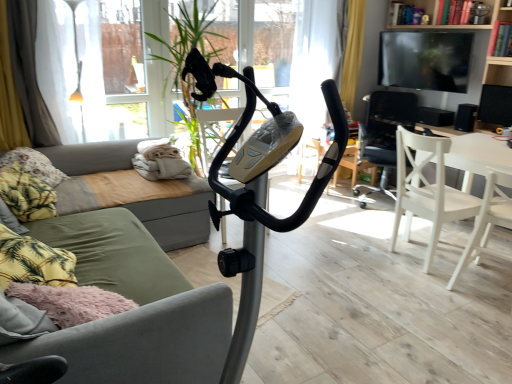
Question: Is white wood chair at center right, which is the first chair in back-to-front order, in front of or behind green fabric couch at center in the image?

Choices:
 (A) behind
 (B) front

Answer: (A)

Question: From a real-world perspective, is white wood chair at center right, which is the first chair in back-to-front order, positioned above or below green fabric couch at center?

Choices:
 (A) above
 (B) below

Answer: (A)

Question: Based on their relative distances, which object is nearer to the white wood chair at lower right, positioned as the 2th chair in back-to-front order?

Choices:
 (A) wooden bookshelf at upper right
 (B) fluffy fabric pillow at left, placed as the second pillow when sorted from back to front
 (C) black glossy tv at upper right
 (D) black matte speaker at center, which is the 1th speaker in back-to-front order
 (E) green fabric couch at center

Answer: (D)

Question: Which of these objects is positioned farthest from the white wood chair at right, acting as the 3th chair starting from the back?

Choices:
 (A) wooden bookshelf at upper right
 (B) fluffy fabric pillow at left, which appears as the first pillow when viewed from the front
 (C) fluffy fabric pillow at left, arranged as the 1th pillow when viewed from the back
 (D) black matte speaker at right, which is the 2th speaker in back-to-front order
 (E) green fabric couch at left

Answer: (C)